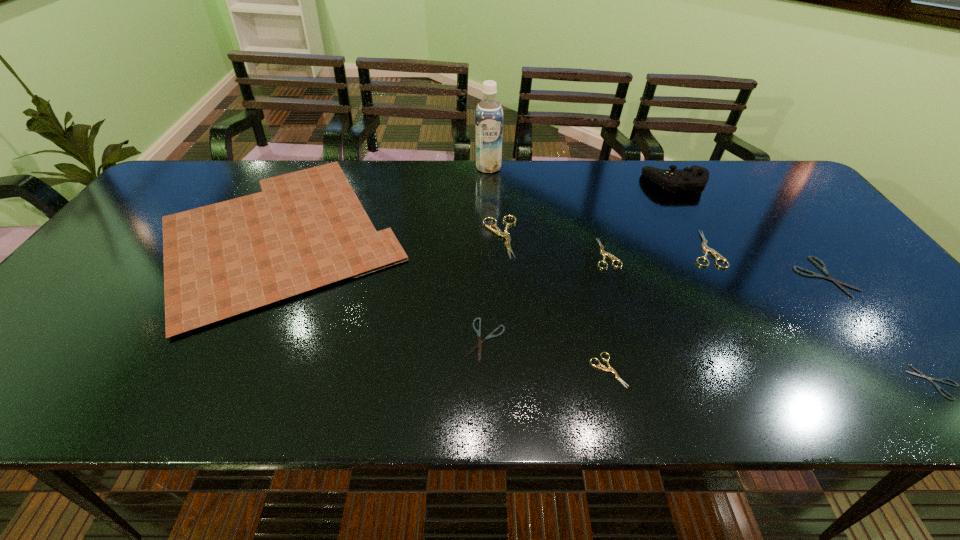
The height and width of the screenshot is (540, 960). What are the coordinates of `the biggest black shears` in the screenshot? It's located at (823, 268).

Where is `the nearest beige shears`? Image resolution: width=960 pixels, height=540 pixels. the nearest beige shears is located at coordinates 610,369.

The width and height of the screenshot is (960, 540). In order to click on the fifth object from left to right in this screenshot , I will do `click(610, 369)`.

At what (x,y) coordinates should I click in order to perform the action: click on the second nearest black shears. Please return your answer as a coordinate pair (x, y). The height and width of the screenshot is (540, 960). Looking at the image, I should click on (479, 345).

This screenshot has width=960, height=540. I want to click on the leftmost black shears, so tap(479, 345).

Locate an element on the screen. The height and width of the screenshot is (540, 960). vacant space located 0.150m on the label of the soya milk is located at coordinates (490, 201).

At what (x,y) coordinates should I click in order to perform the action: click on free space located 0.090m on the right of the second tallest object. Please return your answer as a coordinate pair (x, y). This screenshot has height=540, width=960. Looking at the image, I should click on (736, 183).

This screenshot has width=960, height=540. What are the coordinates of `blank space located 0.350m on the right of the gameboard` in the screenshot? It's located at (540, 234).

Where is `free space located on the front of the biggest beige shears`? This screenshot has height=540, width=960. free space located on the front of the biggest beige shears is located at coordinates (504, 300).

Where is `free space located on the right of the sixth shortest object`? This screenshot has width=960, height=540. free space located on the right of the sixth shortest object is located at coordinates (795, 249).